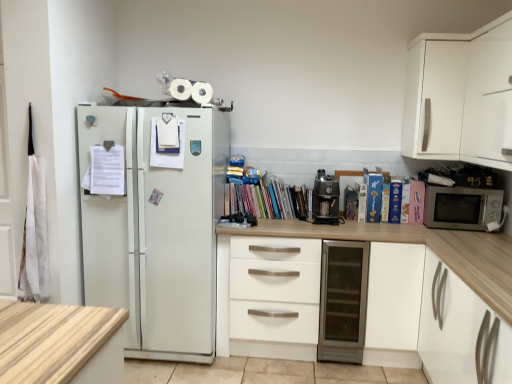
Question: Should I look upward or downward to see satin black coffee machine at center?

Choices:
 (A) down
 (B) up

Answer: (A)

Question: Is satin black coffee machine at center taller than pink matte paperback book at right, acting as the 1th paperback book starting from the right?

Choices:
 (A) no
 (B) yes

Answer: (B)

Question: Is pink matte paperback book at right, acting as the 1th paperback book starting from the right, completely or partially inside satin black coffee machine at center?

Choices:
 (A) no
 (B) yes

Answer: (A)

Question: Considering the relative sizes of satin black coffee machine at center and pink matte paperback book at right, acting as the 1th paperback book starting from the right, in the image provided, is satin black coffee machine at center wider than pink matte paperback book at right, acting as the 1th paperback book starting from the right,?

Choices:
 (A) no
 (B) yes

Answer: (B)

Question: Could you tell me if satin black coffee machine at center is facing pink matte paperback book at right, which is the 5th paperback book from left to right?

Choices:
 (A) yes
 (B) no

Answer: (B)

Question: Does satin black coffee machine at center have a lesser width compared to pink matte paperback book at right, acting as the 1th paperback book starting from the right?

Choices:
 (A) yes
 (B) no

Answer: (B)

Question: Is satin black coffee machine at center not near pink matte paperback book at right, which is the 5th paperback book from left to right?

Choices:
 (A) yes
 (B) no

Answer: (B)

Question: Is hardcover book at right, which is the 4th paperback book in right-to-left order, facing towards multicolored paperbacks at center?

Choices:
 (A) yes
 (B) no

Answer: (B)

Question: Can you see hardcover book at right, which is the 4th paperback book in right-to-left order, touching multicolored paperbacks at center?

Choices:
 (A) yes
 (B) no

Answer: (B)

Question: Is hardcover book at right, which ranks as the 2th paperback book in left-to-right order, bigger than multicolored paperbacks at center?

Choices:
 (A) no
 (B) yes

Answer: (A)

Question: From the image's perspective, is hardcover book at right, which ranks as the 2th paperback book in left-to-right order, over multicolored paperbacks at center?

Choices:
 (A) no
 (B) yes

Answer: (A)

Question: From a real-world perspective, is hardcover book at right, which is the 4th paperback book in right-to-left order, below multicolored paperbacks at center?

Choices:
 (A) yes
 (B) no

Answer: (B)

Question: From the image's perspective, is hardcover book at right, which ranks as the 2th paperback book in left-to-right order, located beneath multicolored paperbacks at center?

Choices:
 (A) yes
 (B) no

Answer: (A)

Question: Does hardcover book at right, which is the 2th paperback book from right to left, come behind metallic glass door fridge at center?

Choices:
 (A) yes
 (B) no

Answer: (A)